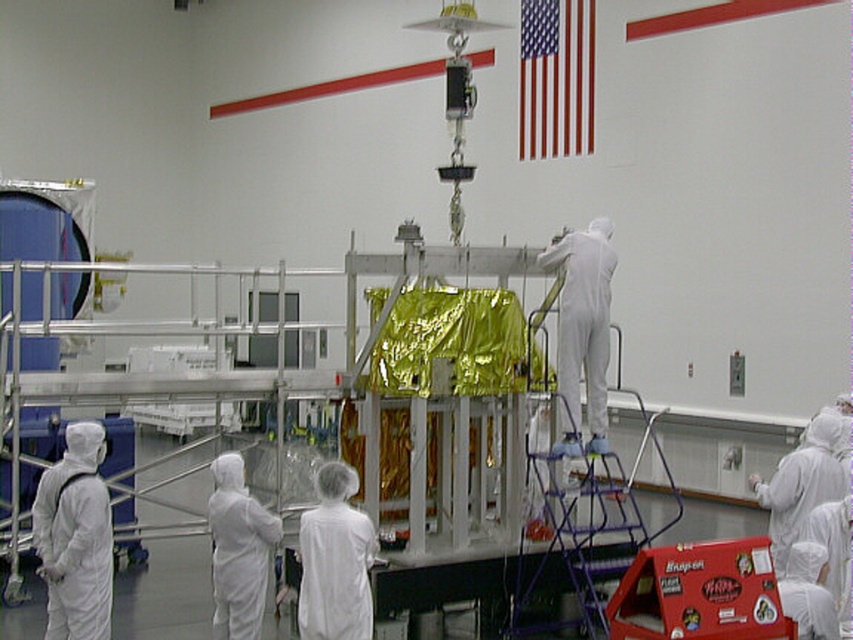
Question: Which object appears farthest from the camera in this image?

Choices:
 (A) white matte suit at left
 (B) red fabric flag at upper right
 (C) white matte suit at center
 (D) red cardboard box at center

Answer: (B)

Question: In this image, where is white matte suit at left located relative to white matte suit at lower left?

Choices:
 (A) above
 (B) below

Answer: (A)

Question: Which point is closer to the camera?

Choices:
 (A) (106, 608)
 (B) (566, 83)
 (C) (323, 560)

Answer: (C)

Question: Among these objects, which one is nearest to the camera?

Choices:
 (A) white matte suit at lower left
 (B) white matte lab coat at center

Answer: (B)

Question: Does white matte suit at left have a lesser width compared to white matte lab coat at center?

Choices:
 (A) yes
 (B) no

Answer: (B)

Question: Does blue metallic ladder at center lie behind white matte suit at left?

Choices:
 (A) no
 (B) yes

Answer: (B)